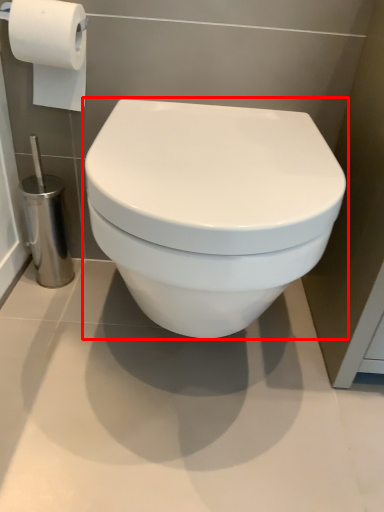
Question: From the image, what is the correct spatial relationship of toilet (annotated by the red box) in relation to toilet paper?

Choices:
 (A) right
 (B) left

Answer: (A)